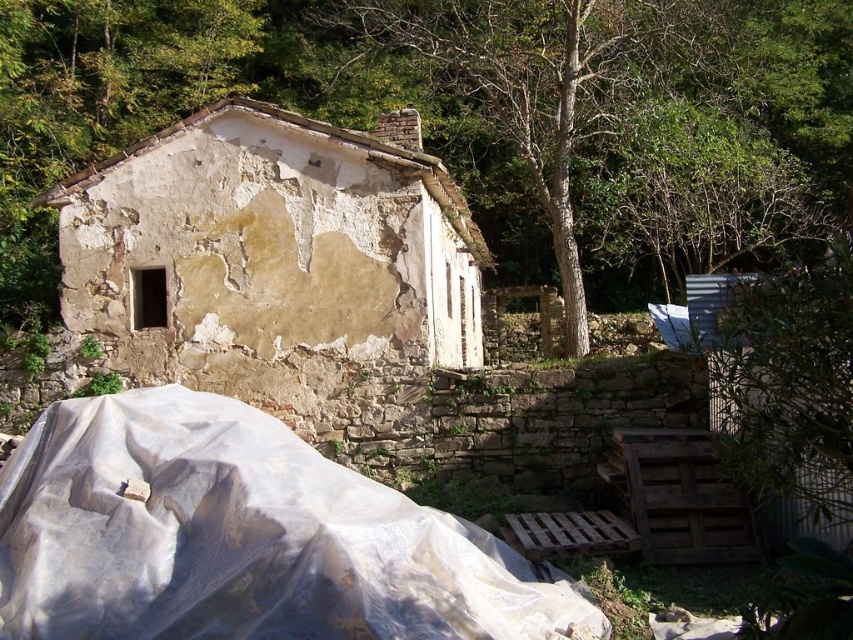
Is transparent plastic at lower left smaller than brown rough bark tree at upper center?

Correct, transparent plastic at lower left occupies less space than brown rough bark tree at upper center.

In order to click on transparent plastic at lower left in this screenshot , I will do `click(242, 538)`.

Does point (90, 448) come closer to viewer compared to point (466, 67)?

Yes, point (90, 448) is in front of point (466, 67).

The image size is (853, 640). Identify the location of transparent plastic at lower left. (242, 538).